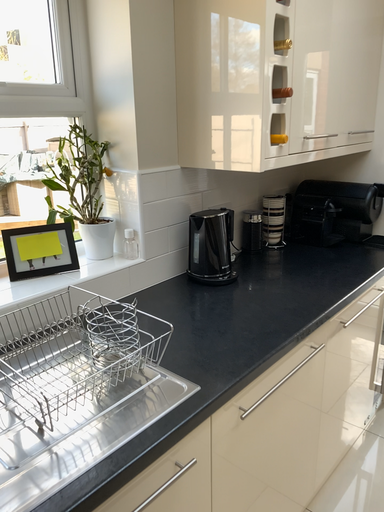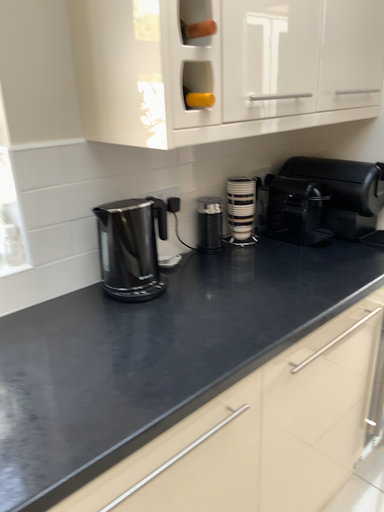
Question: Which way did the camera rotate in the video?

Choices:
 (A) rotated left
 (B) rotated right

Answer: (A)